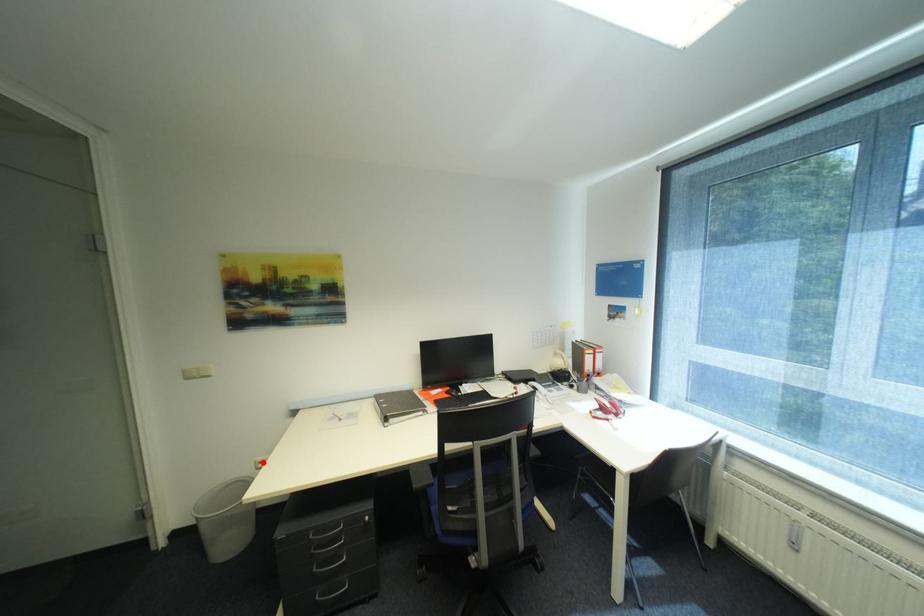
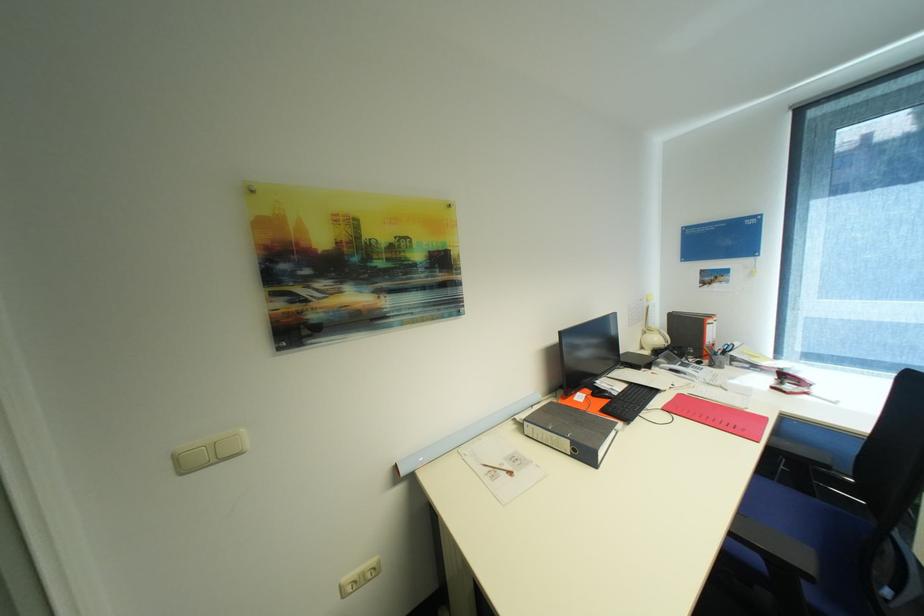
Question: I am providing you with two images of the same scene from different viewpoints. In image1, a red point is highlighted. Considering the same 3D point in image2, which of the following is correct?

Choices:
 (A) It is closer
 (B) It is farther

Answer: (A)